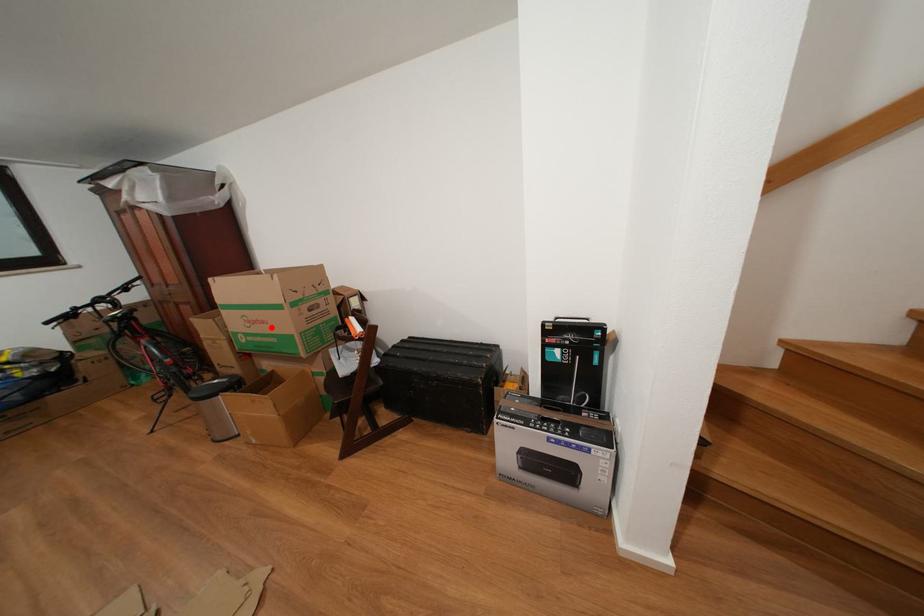
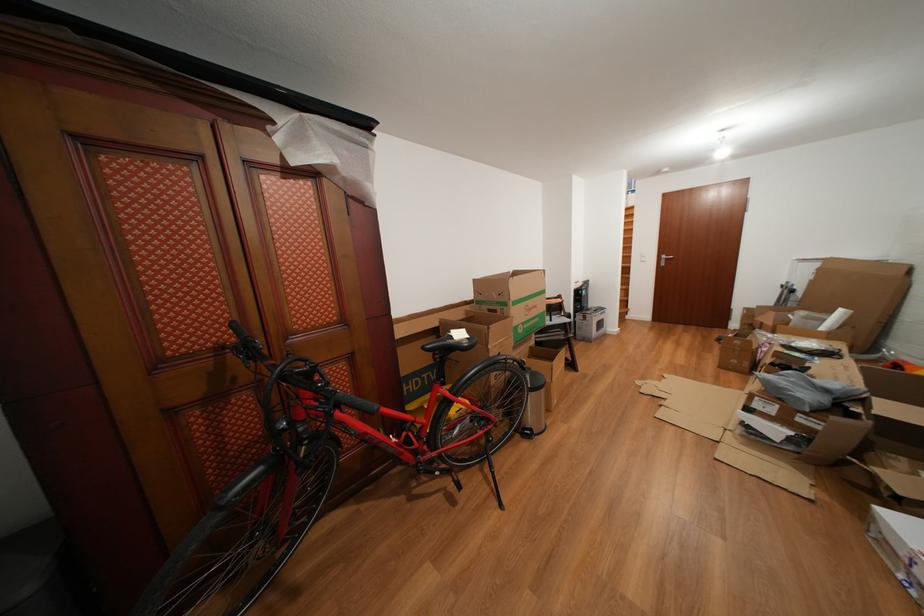
Find the pixel in the second image that matches the highlighted location in the first image.

(543, 312)